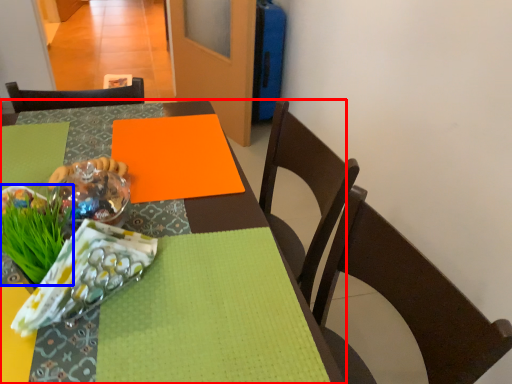
Question: Among these objects, which one is farthest to the camera, table (highlighted by a red box) or grass (highlighted by a blue box)?

Choices:
 (A) table
 (B) grass

Answer: (B)